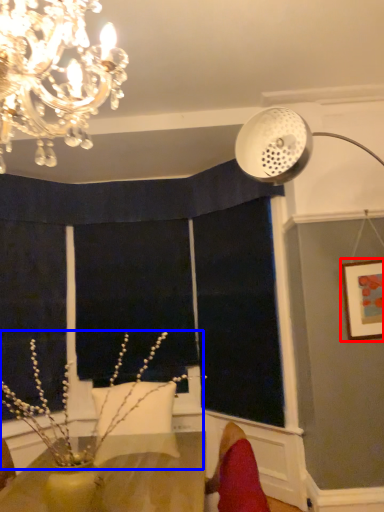
Question: Which of the following is the closest to the observer, picture frame (highlighted by a red box) or plant (highlighted by a blue box)?

Choices:
 (A) picture frame
 (B) plant

Answer: (B)